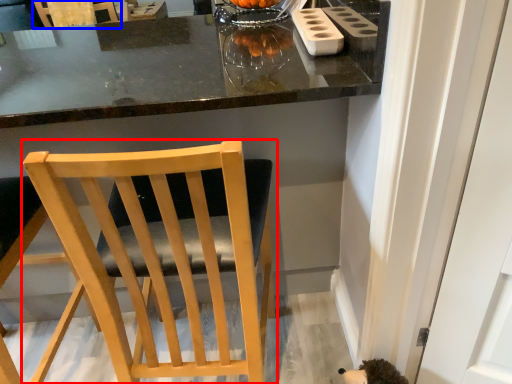
Question: Among these objects, which one is farthest to the camera, chair (highlighted by a red box) or chair (highlighted by a blue box)?

Choices:
 (A) chair
 (B) chair

Answer: (B)